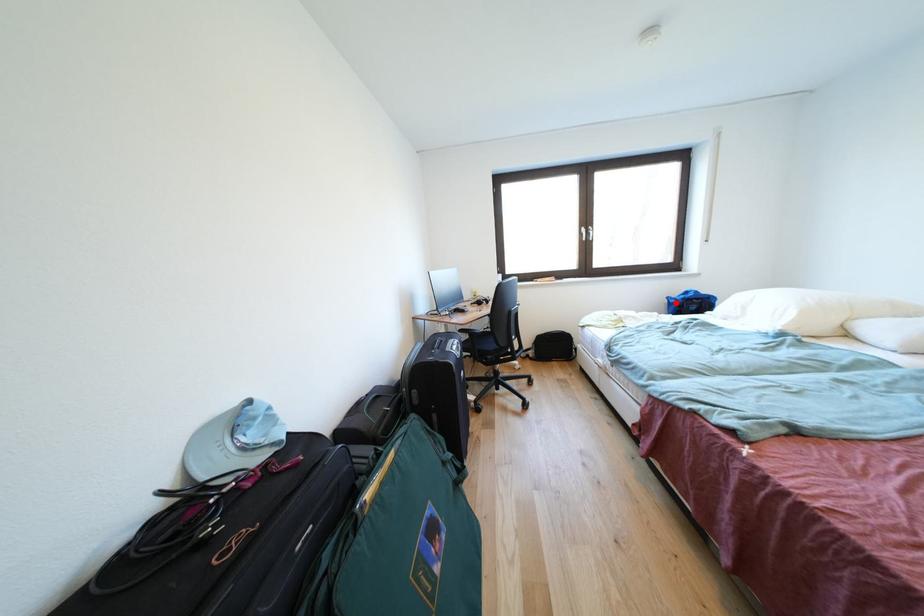
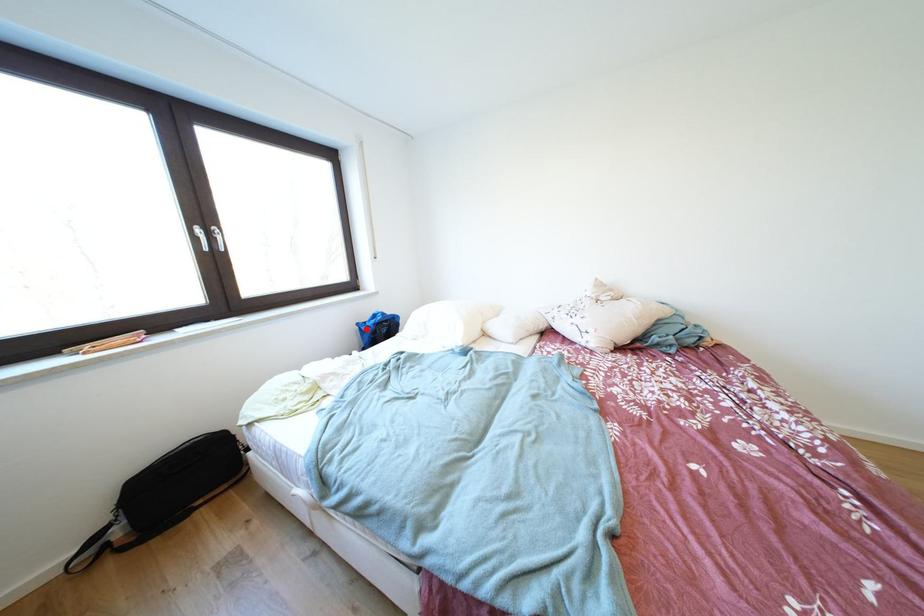
I am providing you with two images of the same scene from different viewpoints. A red point is marked on the first image and another point is marked on the second image. Does the point marked in image1 correspond to the same location as the one in image2?

Yes